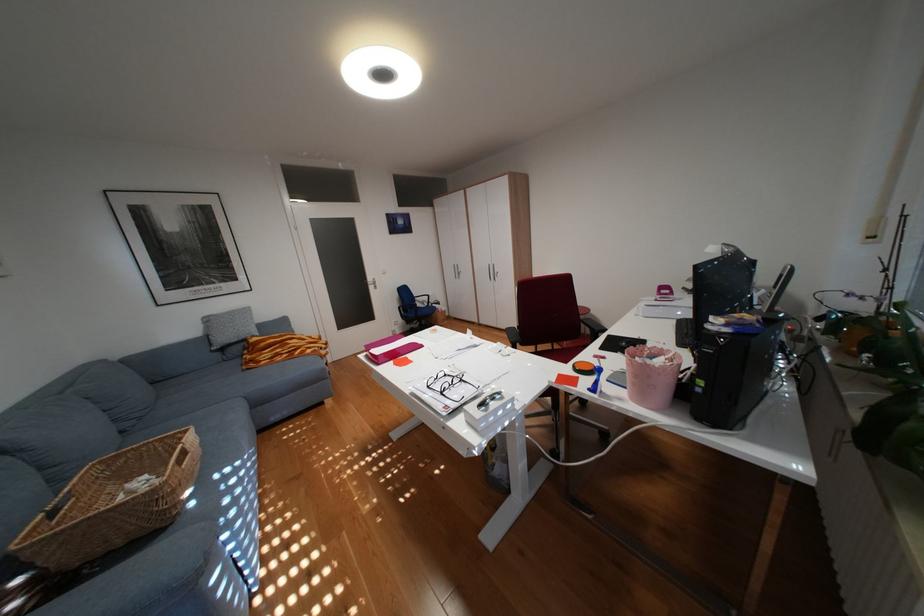
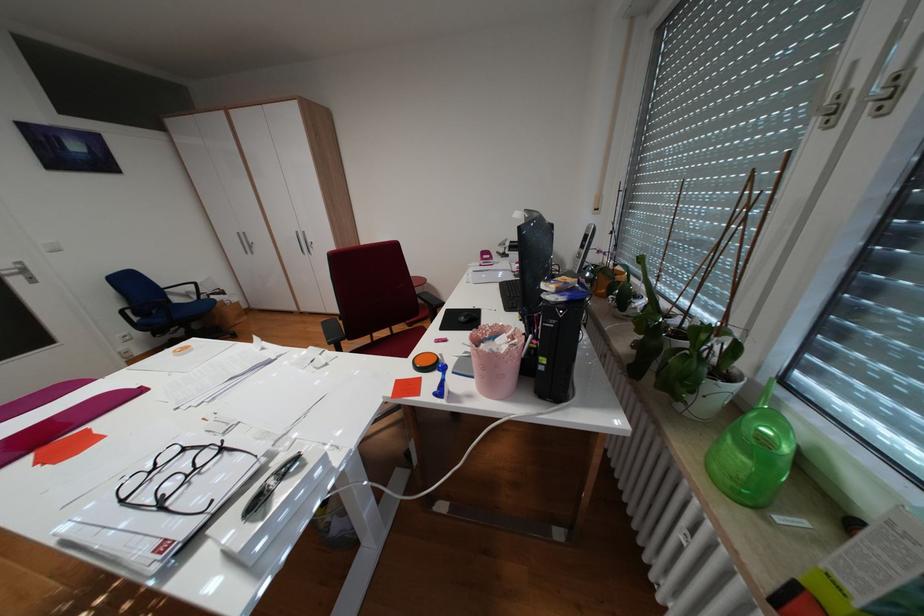
Find the pixel in the second image that matches (454,392) in the first image.

(173, 505)